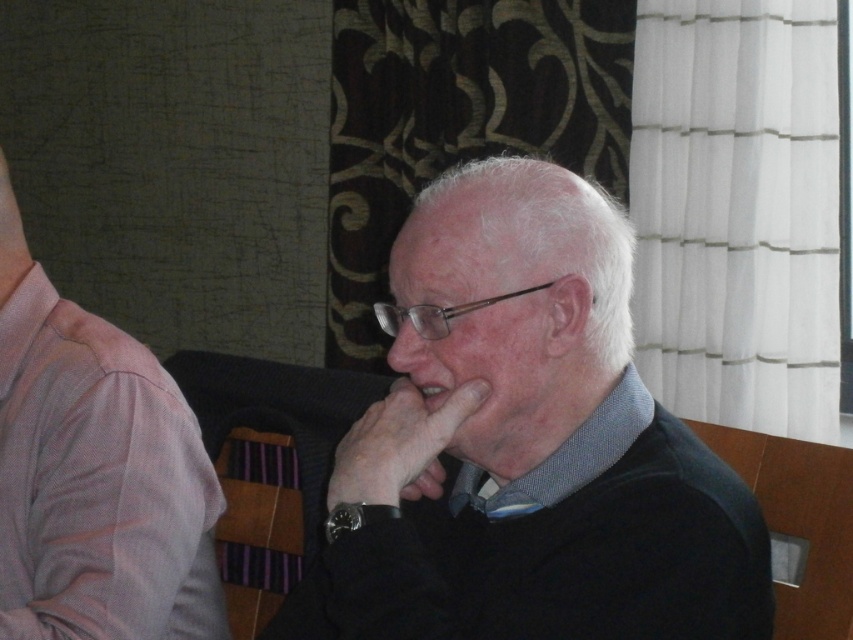
Between point (630, 582) and point (137, 490), which one is positioned behind?

The point (137, 490) is behind.

Can you confirm if matte black sweater at center is thinner than pink fabric shirt at left?

No.

Where is `matte black sweater at center`? matte black sweater at center is located at coordinates (527, 445).

The height and width of the screenshot is (640, 853). What are the coordinates of `matte black sweater at center` in the screenshot? It's located at (527, 445).

Is matte black sweater at center further to the viewer compared to matte glass nose at center?

No, it is not.

Does matte black sweater at center have a greater width compared to matte glass nose at center?

Correct, the width of matte black sweater at center exceeds that of matte glass nose at center.

What are the coordinates of `matte black sweater at center` in the screenshot? It's located at (527, 445).

Where is `matte black sweater at center`? matte black sweater at center is located at coordinates click(x=527, y=445).

Is matte black face at center bigger than matte glass nose at center?

Yes.

At what (x,y) coordinates should I click in order to perform the action: click on matte black face at center. Please return your answer as a coordinate pair (x, y). This screenshot has width=853, height=640. Looking at the image, I should click on (494, 372).

Who is more forward, (558, 337) or (392, 348)?

Point (558, 337) is more forward.

Where is `matte black face at center`? The width and height of the screenshot is (853, 640). matte black face at center is located at coordinates (494, 372).